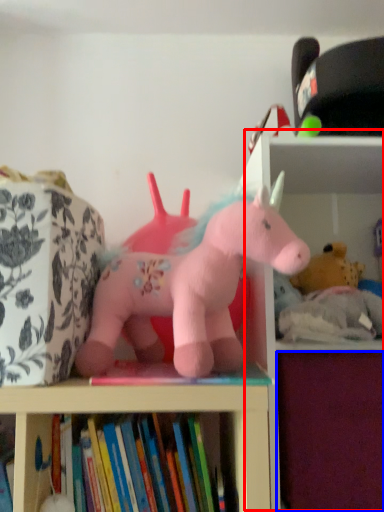
Question: Which point is further to the camera, bookshelf (highlighted by a red box) or drawer (highlighted by a blue box)?

Choices:
 (A) bookshelf
 (B) drawer

Answer: (B)